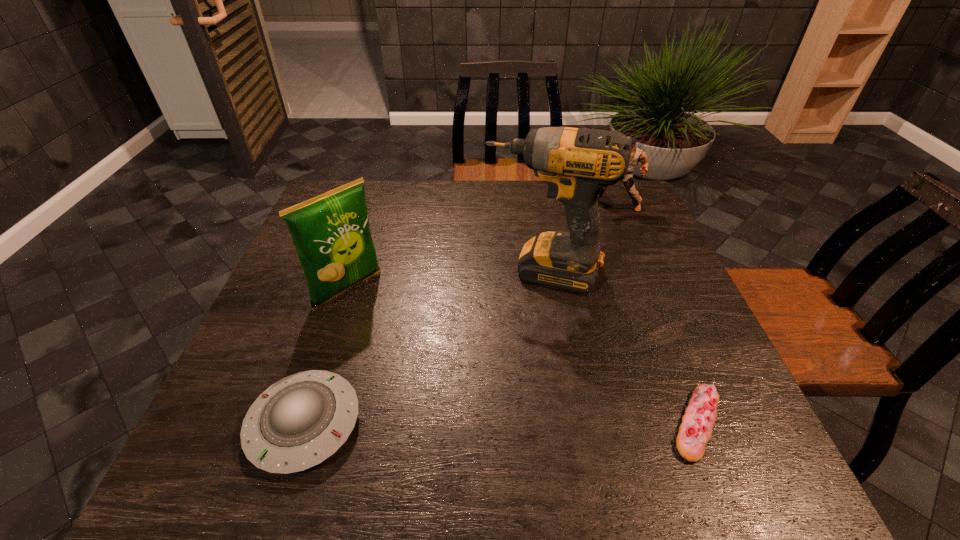
You are a GUI agent. You are given a task and a screenshot of the screen. Output one action in this format:
    pyautogui.click(x=<x>, y=<y>)
    Task: Click on the free space between the third object from right to left and the crisp (potato chip)
    
    Given the screenshot: What is the action you would take?
    pyautogui.click(x=445, y=280)

What are the coordinates of `vacant space in between the drill and the crisp (potato chip)` in the screenshot? It's located at (445, 280).

Choose which object is the nearest neighbor to the shortest object. Please provide its 2D coordinates. Your answer should be formatted as a tuple, i.e. [(x, y)], where the tuple contains the x and y coordinates of a point satisfying the conditions above.

[(576, 163)]

The image size is (960, 540). Identify the location of the second closest object to the drill. pos(695,431).

I want to click on vacant space that satisfies the following two spatial constraints: 1. on the front side of the shortest object; 2. on the right side of the tallest object, so point(567,423).

You are a GUI agent. You are given a task and a screenshot of the screen. Output one action in this format:
    pyautogui.click(x=<x>, y=<y>)
    Task: Click on the vacant space that satisfies the following two spatial constraints: 1. on the back side of the saucer; 2. on the right side of the third tallest object
    The width and height of the screenshot is (960, 540).
    Given the screenshot: What is the action you would take?
    coord(374,206)

Identify the location of vacant point that satisfies the following two spatial constraints: 1. on the front side of the third object from left to right; 2. on the left side of the eclair. (567, 423).

Identify the location of vacant region that satisfies the following two spatial constraints: 1. on the back side of the crisp (potato chip); 2. on the left side of the saucer. The image size is (960, 540). (348, 289).

Locate an element on the screen. free space that satisfies the following two spatial constraints: 1. on the back side of the fourth tallest object; 2. on the right side of the drill is located at coordinates (353, 272).

Where is `vacant region that satisfies the following two spatial constraints: 1. on the back side of the second shortest object; 2. on the right side of the crisp (potato chip)`? The height and width of the screenshot is (540, 960). vacant region that satisfies the following two spatial constraints: 1. on the back side of the second shortest object; 2. on the right side of the crisp (potato chip) is located at coordinates (348, 289).